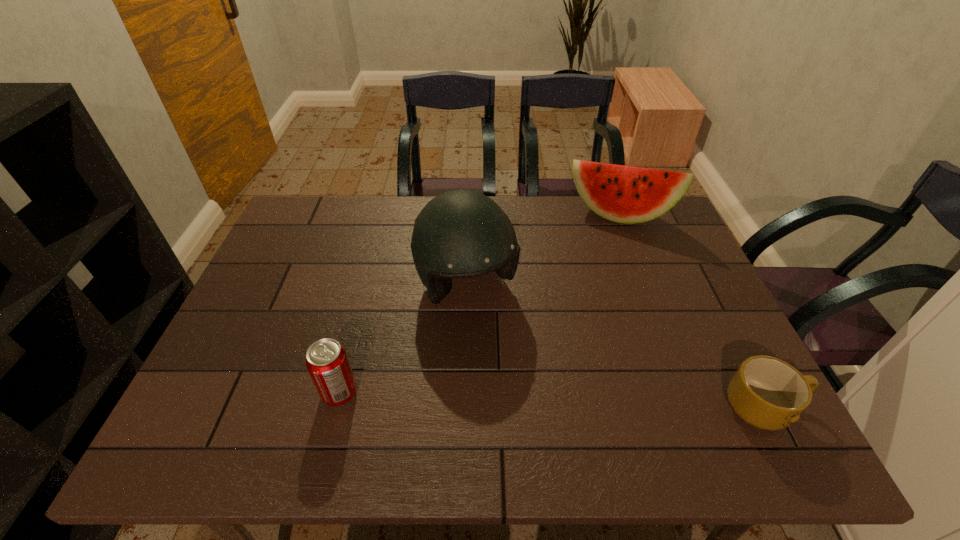
Locate an element on the screen. The image size is (960, 540). free spot on the desktop that is between the soda and the shortest object and is positioned at the face opening of the third object from right to left is located at coordinates (537, 400).

Locate an element on the screen. This screenshot has height=540, width=960. free space on the desktop that is between the soda and the shortest object and is positioned on the outer rind of the second tallest object is located at coordinates (588, 402).